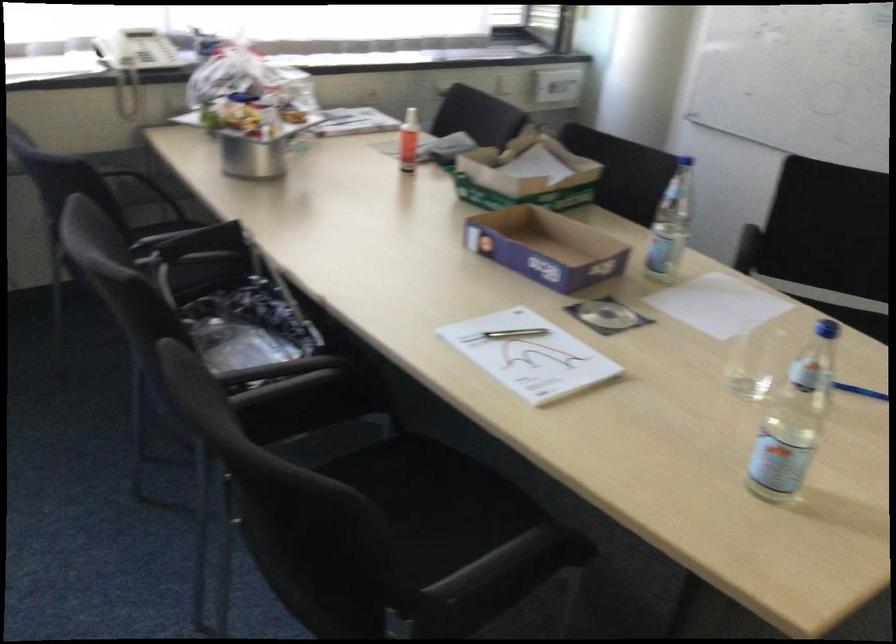
The location [546,247] corresponds to which object?

This point indicates the purple cardboard box.